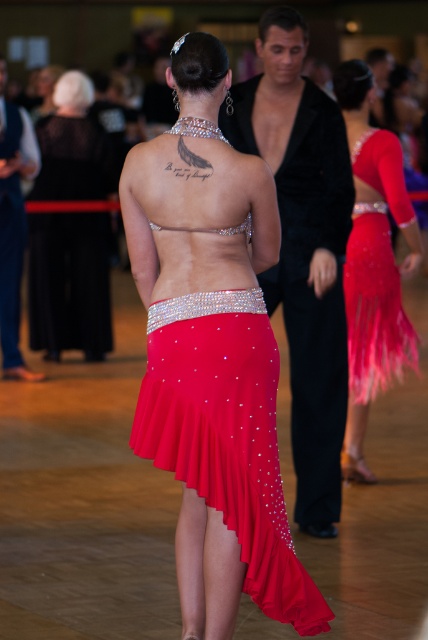
Between shiny satin skirt at center and shiny sequined skirt at center, which one appears on the right side from the viewer's perspective?

From the viewer's perspective, shiny sequined skirt at center appears more on the right side.

How far apart are shiny satin skirt at center and shiny sequined skirt at center?

shiny satin skirt at center and shiny sequined skirt at center are 2.73 meters apart.

Between point (276, 548) and point (359, 125), which one is positioned behind?

Positioned behind is point (359, 125).

At what (x,y) coordinates should I click in order to perform the action: click on shiny satin skirt at center. Please return your answer as a coordinate pair (x, y). The height and width of the screenshot is (640, 428). Looking at the image, I should click on (226, 435).

Is shiny sequined skirt at center thinner than matte black dress at center?

Indeed, shiny sequined skirt at center has a lesser width compared to matte black dress at center.

Does point (356, 346) come in front of point (95, 280)?

Yes, it is in front of point (95, 280).

Identify the location of shiny sequined skirt at center. This screenshot has height=640, width=428. (372, 262).

Where is `shiny satin skirt at center`? The width and height of the screenshot is (428, 640). shiny satin skirt at center is located at coordinates (226, 435).

Who is more forward, (238, 342) or (89, 81)?

Point (238, 342)

Which is in front, point (181, 476) or point (32, 196)?

Positioned in front is point (181, 476).

Image resolution: width=428 pixels, height=640 pixels. Identify the location of shiny satin skirt at center. (226, 435).